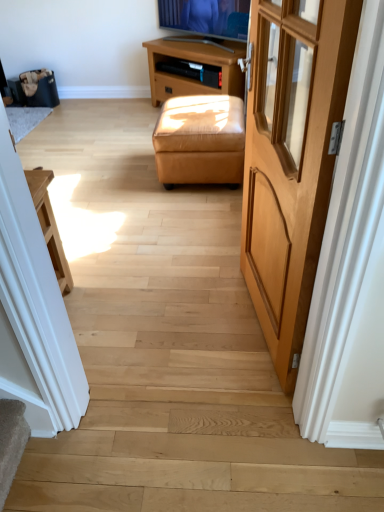
Question: Is light brown wood door at right shorter than brown wooden tv stand at upper center?

Choices:
 (A) yes
 (B) no

Answer: (B)

Question: From the image's perspective, is light brown wood door at right under brown wooden tv stand at upper center?

Choices:
 (A) yes
 (B) no

Answer: (A)

Question: Is light brown wood door at right oriented away from brown wooden tv stand at upper center?

Choices:
 (A) no
 (B) yes

Answer: (A)

Question: Is light brown wood door at right bigger than brown wooden tv stand at upper center?

Choices:
 (A) yes
 (B) no

Answer: (B)

Question: Is light brown wood door at right wider than brown wooden tv stand at upper center?

Choices:
 (A) no
 (B) yes

Answer: (A)

Question: Is light brown wood door at right not close to brown wooden tv stand at upper center?

Choices:
 (A) yes
 (B) no

Answer: (A)

Question: Is light brown wood door at right bigger than tan leather ottoman at center?

Choices:
 (A) yes
 (B) no

Answer: (B)

Question: Is light brown wood door at right aimed at tan leather ottoman at center?

Choices:
 (A) yes
 (B) no

Answer: (B)

Question: Could tan leather ottoman at center be considered to be inside light brown wood door at right?

Choices:
 (A) no
 (B) yes

Answer: (A)

Question: Is light brown wood door at right to the right of tan leather ottoman at center from the viewer's perspective?

Choices:
 (A) no
 (B) yes

Answer: (B)

Question: Can you confirm if light brown wood door at right is shorter than tan leather ottoman at center?

Choices:
 (A) yes
 (B) no

Answer: (B)

Question: From the image's perspective, is light brown wood door at right under tan leather ottoman at center?

Choices:
 (A) yes
 (B) no

Answer: (A)

Question: Is tan leather ottoman at center completely or partially inside brown wooden tv stand at upper center?

Choices:
 (A) yes
 (B) no

Answer: (B)